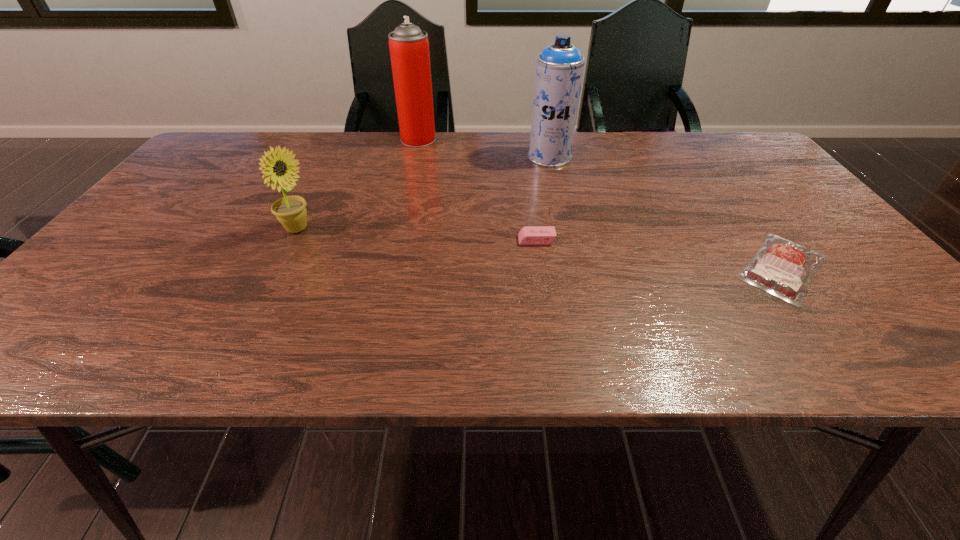
The image size is (960, 540). Find the location of `empty location between the eraser and the left aerosol can`. empty location between the eraser and the left aerosol can is located at coordinates (477, 190).

You are a GUI agent. You are given a task and a screenshot of the screen. Output one action in this format:
    pyautogui.click(x=<x>, y=<y>)
    Task: Click on the empty location between the right aerosol can and the sunflower
    The height and width of the screenshot is (540, 960).
    Given the screenshot: What is the action you would take?
    pyautogui.click(x=423, y=193)

The height and width of the screenshot is (540, 960). In order to click on vacant area that lies between the third shortest object and the right aerosol can in this screenshot , I will do (423, 193).

At what (x,y) coordinates should I click in order to perform the action: click on free space between the leftmost object and the left aerosol can. Please return your answer as a coordinate pair (x, y). This screenshot has width=960, height=540. Looking at the image, I should click on (358, 184).

Where is `free area in between the eraser and the third shortest object`? free area in between the eraser and the third shortest object is located at coordinates (417, 235).

Where is `free area in between the right aerosol can and the fourth object from right to left`? The height and width of the screenshot is (540, 960). free area in between the right aerosol can and the fourth object from right to left is located at coordinates pos(484,148).

This screenshot has height=540, width=960. I want to click on empty space between the sunflower and the rightmost object, so click(540, 248).

What are the coordinates of `free point between the right aerosol can and the second object from left to right` in the screenshot? It's located at (484, 148).

Identify which object is located as the fourth nearest to the right aerosol can. Please provide its 2D coordinates. Your answer should be formatted as a tuple, i.e. [(x, y)], where the tuple contains the x and y coordinates of a point satisfying the conditions above.

[(291, 212)]

The height and width of the screenshot is (540, 960). What are the coordinates of `object that is the third closest one to the third shortest object` in the screenshot? It's located at (559, 68).